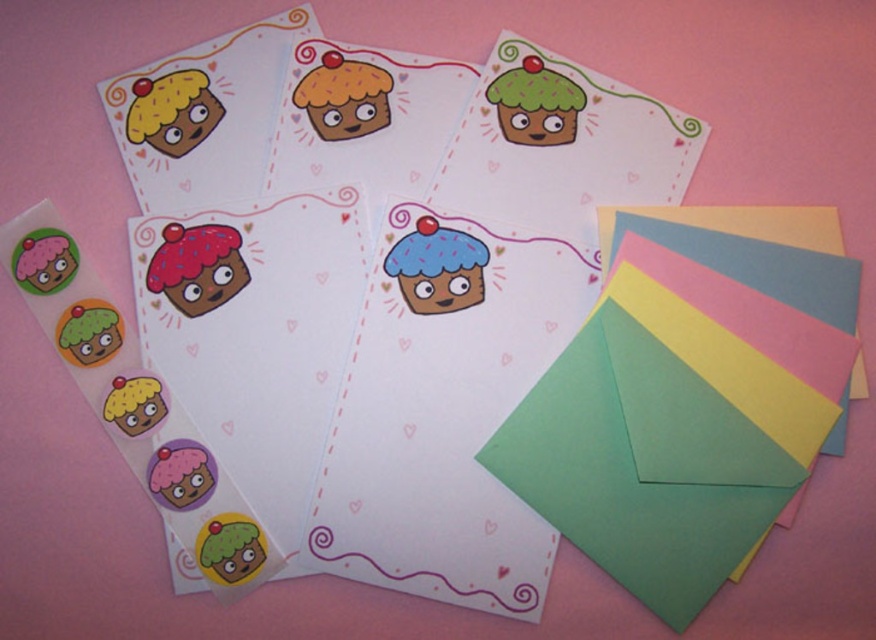
You are designing a greeting card layout and want to place a sticker exactly at the center of the blue matte cupcake at center. According to the coordinates provided, where should you place the sticker?

The sticker should be placed at the coordinates point (438, 268) to be exactly at the center of the blue matte cupcake at center.

You are holding a pen and want to write a message on the card located at point (495,90). Considering the distance, can you comfortably write without leaning too far?

The point (495,90) is 69.99 centimeters away from the viewer, which is a comfortable distance for writing without needing to lean too far.

You are organizing a birthday party and need to arrange the matte pink cupcake at center and the matte yellow cupcake at upper left on a shelf. According to the image, which cupcake should be placed lower on the shelf?

The matte pink cupcake at center should be placed lower on the shelf because it is located below the matte yellow cupcake at upper left in the image.